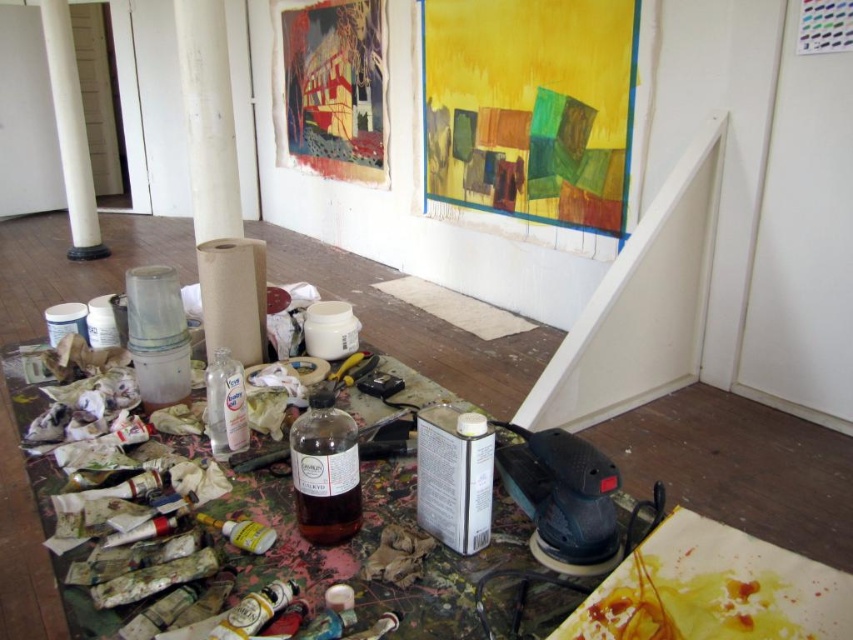
You are an artist who just spilled red paint on your white apron. You need to find the nearest paint tube to clean it. The studio has a matte gold paint tube at lower center and a small plastic container at lower right. Which one is closer to your current position at point (254, 611)?

The point (254, 611) corresponds to the matte gold paint tube at lower center, so you are already at the location of the matte gold paint tube at lower center. Therefore, it is the closest to you.

You are an artist who needs to choose between the matte gold paint tube at lower center and the translucent yellow bottle at center for a project that requires a larger volume of material. Which object should you select?

The translucent yellow bottle at center has a larger size compared to the matte gold paint tube at lower center, so you should select the translucent yellow bottle at center for the project requiring a larger volume of material.